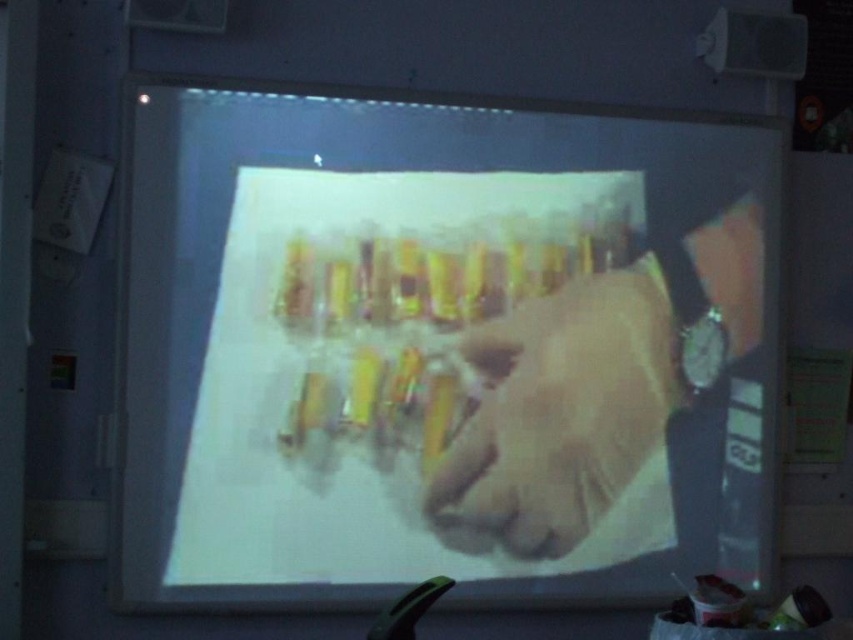
Who is positioned more to the right, matte plastic projector screen at center or smooth beige hand at center?

Positioned to the right is smooth beige hand at center.

Does matte plastic projector screen at center appear over smooth beige hand at center?

Indeed, matte plastic projector screen at center is positioned over smooth beige hand at center.

Is point (183, 429) farther from viewer compared to point (645, 400)?

No, (183, 429) is closer to viewer.

Where is `matte plastic projector screen at center`? matte plastic projector screen at center is located at coordinates (442, 349).